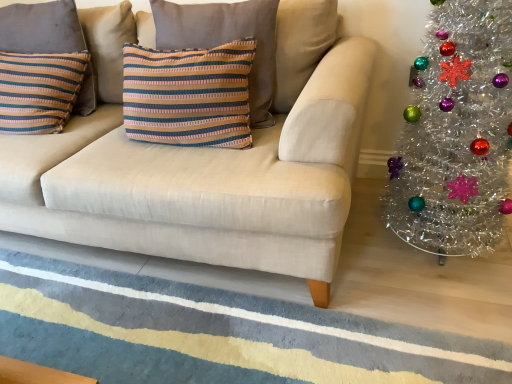
Describe the element at coordinates (456, 134) in the screenshot. I see `tinsel silver christmas tree at right` at that location.

The width and height of the screenshot is (512, 384). Describe the element at coordinates (41, 28) in the screenshot. I see `striped fabric pillow at left, which is the 1th pillow from left to right` at that location.

Find the location of `striped fabric pillow at left, marked as the second pillow in a right-to-left arrangement`. striped fabric pillow at left, marked as the second pillow in a right-to-left arrangement is located at coordinates (41, 28).

Where is `tinsel silver christmas tree at right`? Image resolution: width=512 pixels, height=384 pixels. tinsel silver christmas tree at right is located at coordinates (456, 134).

Does tinsel silver christmas tree at right have a smaller size compared to striped fabric pillow at center, the first pillow in the right-to-left sequence?

No.

Does tinsel silver christmas tree at right have a lesser height compared to striped fabric pillow at center, the 2th pillow in the left-to-right sequence?

No.

Considering the sizes of objects tinsel silver christmas tree at right and striped fabric pillow at center, the 2th pillow in the left-to-right sequence, in the image provided, who is wider, tinsel silver christmas tree at right or striped fabric pillow at center, the 2th pillow in the left-to-right sequence,?

With larger width is tinsel silver christmas tree at right.

Consider the image. From the image's perspective, is tinsel silver christmas tree at right under striped fabric pillow at center, the 2th pillow in the left-to-right sequence?

Yes.

Starting from the tinsel silver christmas tree at right, which pillow is the 2nd one to the left? Please provide its 2D coordinates.

[(41, 28)]

Considering the positions of objects tinsel silver christmas tree at right and striped fabric pillow at left, marked as the second pillow in a right-to-left arrangement, in the image provided, who is behind, tinsel silver christmas tree at right or striped fabric pillow at left, marked as the second pillow in a right-to-left arrangement,?

striped fabric pillow at left, marked as the second pillow in a right-to-left arrangement, is behind.

From the image's perspective, between tinsel silver christmas tree at right and striped fabric pillow at left, marked as the second pillow in a right-to-left arrangement, who is located below?

Result: tinsel silver christmas tree at right appears lower in the image.

Consider the image. Does tinsel silver christmas tree at right have a greater height compared to striped fabric pillow at left, which is the 1th pillow from left to right?

Yes, tinsel silver christmas tree at right is taller than striped fabric pillow at left, which is the 1th pillow from left to right.

Does point (19, 43) come behind point (322, 77)?

Yes, it is.

Can you confirm if striped fabric pillow at left, which is the 1th pillow from left to right, is wider than beige fabric couch at center?

In fact, striped fabric pillow at left, which is the 1th pillow from left to right, might be narrower than beige fabric couch at center.

In the scene shown: Is striped fabric pillow at left, which is the 1th pillow from left to right, spatially inside beige fabric couch at center, or outside of it?

striped fabric pillow at left, which is the 1th pillow from left to right, can be found inside beige fabric couch at center.

Where is `the 1st pillow above the beige fabric couch at center (from the image's perspective)`? the 1st pillow above the beige fabric couch at center (from the image's perspective) is located at coordinates (226, 40).

Could beige fabric couch at center be considered to be inside striped fabric pillow at center, the 2th pillow in the left-to-right sequence?

No, beige fabric couch at center is not a part of striped fabric pillow at center, the 2th pillow in the left-to-right sequence.

Could you tell me if striped fabric pillow at center, the 2th pillow in the left-to-right sequence, is turned towards beige fabric couch at center?

Yes.

Considering the points (269, 29) and (22, 44), which point is behind, point (269, 29) or point (22, 44)?

The point (22, 44) is more distant.

The height and width of the screenshot is (384, 512). In order to click on pillow behind the striped fabric pillow at center, the first pillow in the right-to-left sequence in this screenshot , I will do `click(41, 28)`.

Is striped fabric pillow at center, the first pillow in the right-to-left sequence, thinner than striped fabric pillow at left, which is the 1th pillow from left to right?

In fact, striped fabric pillow at center, the first pillow in the right-to-left sequence, might be wider than striped fabric pillow at left, which is the 1th pillow from left to right.

Based on the photo, is striped fabric pillow at center, the 2th pillow in the left-to-right sequence, far from striped fabric pillow at left, which is the 1th pillow from left to right?

No, there isn't a large distance between striped fabric pillow at center, the 2th pillow in the left-to-right sequence, and striped fabric pillow at left, which is the 1th pillow from left to right.

Considering the sizes of striped fabric pillow at left, marked as the second pillow in a right-to-left arrangement, and striped fabric pillow at center, the 2th pillow in the left-to-right sequence, in the image, is striped fabric pillow at left, marked as the second pillow in a right-to-left arrangement, taller or shorter than striped fabric pillow at center, the 2th pillow in the left-to-right sequence,?

Clearly, striped fabric pillow at left, marked as the second pillow in a right-to-left arrangement, is shorter compared to striped fabric pillow at center, the 2th pillow in the left-to-right sequence.

From a real-world perspective, is striped fabric pillow at left, which is the 1th pillow from left to right, positioned under striped fabric pillow at center, the first pillow in the right-to-left sequence, based on gravity?

No, from a real-world perspective, striped fabric pillow at left, which is the 1th pillow from left to right, is not below striped fabric pillow at center, the first pillow in the right-to-left sequence.

Is striped fabric pillow at left, which is the 1th pillow from left to right, far away from striped fabric pillow at center, the first pillow in the right-to-left sequence?

No, there isn't a large distance between striped fabric pillow at left, which is the 1th pillow from left to right, and striped fabric pillow at center, the first pillow in the right-to-left sequence.

Is striped fabric pillow at left, which is the 1th pillow from left to right, outside of striped fabric pillow at center, the first pillow in the right-to-left sequence?

Yes.

How much distance is there between textured wool rug at lower center and beige fabric couch at center?

textured wool rug at lower center and beige fabric couch at center are 15.44 inches apart.

From a real-world perspective, is textured wool rug at lower center located higher than beige fabric couch at center?

Actually, textured wool rug at lower center is physically below beige fabric couch at center in the real world.

From the image's perspective, is textured wool rug at lower center positioned above or below beige fabric couch at center?

textured wool rug at lower center is situated lower than beige fabric couch at center in the image.

Which is less distant, (x=110, y=345) or (x=8, y=218)?

The point (x=110, y=345) is closer to the camera.

Where is `christmas tree that appears below the striped fabric pillow at center, the 2th pillow in the left-to-right sequence (from the image's perspective)`? The image size is (512, 384). christmas tree that appears below the striped fabric pillow at center, the 2th pillow in the left-to-right sequence (from the image's perspective) is located at coordinates (456, 134).

This screenshot has height=384, width=512. There is a tinsel silver christmas tree at right. Identify the location of the 2nd pillow above it (from a real-world perspective). (41, 28).

Which object lies nearer to the anchor point tinsel silver christmas tree at right, striped fabric pillow at left, marked as the second pillow in a right-to-left arrangement, or striped fabric pillow at center, the first pillow in the right-to-left sequence?

striped fabric pillow at center, the first pillow in the right-to-left sequence, is closer to tinsel silver christmas tree at right.

Which object lies nearer to the anchor point textured wool rug at lower center, striped fabric pillow at left, marked as the second pillow in a right-to-left arrangement, or tinsel silver christmas tree at right?

Among the two, tinsel silver christmas tree at right is located nearer to textured wool rug at lower center.

Looking at this image, from the image, which object appears to be farther from beige fabric couch at center, striped fabric pillow at center, the first pillow in the right-to-left sequence, or tinsel silver christmas tree at right?

Among the two, tinsel silver christmas tree at right is located further to beige fabric couch at center.

From the image, which object appears to be farther from textured wool rug at lower center, beige fabric couch at center or striped fabric pillow at center, the first pillow in the right-to-left sequence?

Among the two, striped fabric pillow at center, the first pillow in the right-to-left sequence, is located further to textured wool rug at lower center.

From the image, which object appears to be nearer to textured wool rug at lower center, striped fabric pillow at center, the first pillow in the right-to-left sequence, or striped fabric pillow at left, marked as the second pillow in a right-to-left arrangement?

striped fabric pillow at center, the first pillow in the right-to-left sequence, is positioned closer to the anchor textured wool rug at lower center.

Estimate the real-world distances between objects in this image. Which object is closer to beige fabric couch at center, textured wool rug at lower center or striped fabric pillow at center, the first pillow in the right-to-left sequence?

The object closer to beige fabric couch at center is striped fabric pillow at center, the first pillow in the right-to-left sequence.

From the image, which object appears to be nearer to striped fabric pillow at center, the 2th pillow in the left-to-right sequence, tinsel silver christmas tree at right or striped fabric pillow at left, marked as the second pillow in a right-to-left arrangement?

Based on the image, striped fabric pillow at left, marked as the second pillow in a right-to-left arrangement, appears to be nearer to striped fabric pillow at center, the 2th pillow in the left-to-right sequence.

Estimate the real-world distances between objects in this image. Which object is closer to textured wool rug at lower center, tinsel silver christmas tree at right or beige fabric couch at center?

The object closer to textured wool rug at lower center is beige fabric couch at center.

Locate an element on the screen. The image size is (512, 384). pillow between textured wool rug at lower center and tinsel silver christmas tree at right in the horizontal direction is located at coordinates (226, 40).

Image resolution: width=512 pixels, height=384 pixels. In order to click on pillow between beige fabric couch at center and tinsel silver christmas tree at right from left to right in this screenshot , I will do `click(226, 40)`.

This screenshot has height=384, width=512. In order to click on pillow between beige fabric couch at center and striped fabric pillow at left, which is the 1th pillow from left to right, from front to back in this screenshot , I will do `click(226, 40)`.

I want to click on stripe between beige fabric couch at center and tinsel silver christmas tree at right, so click(214, 334).